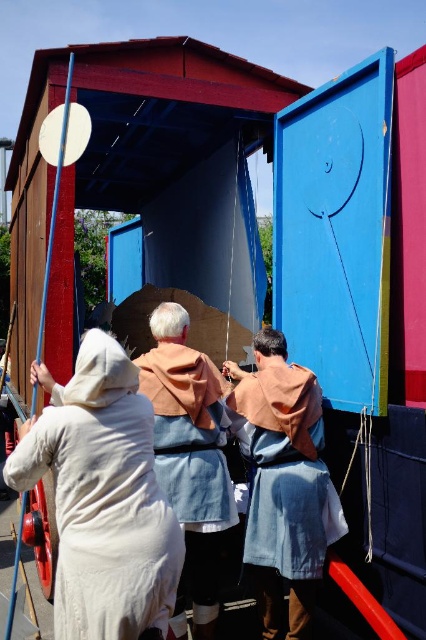
You are standing in front of the stage and notice two points marked on the ground. The first point is at coordinates point (299, 476) and the second is at point (196, 548). Which point is closer to you?

Point (299, 476) is in front of point (196, 548), so it is closer to you.

You are an audience member sitting in the front row of the performance. You notice the white cotton dress at lower left and the denim fabric robe at center. Which costume is shorter in height?

The white cotton dress at lower left has a lesser height compared to denim fabric robe at center, so the white cotton dress at lower left is shorter.

You are standing in front of the stage backdrop and see the white cotton dress at lower left and the white linen dress at center. Which dress is nearer to you?

The white cotton dress at lower left is closer to the viewer than the white linen dress at center.